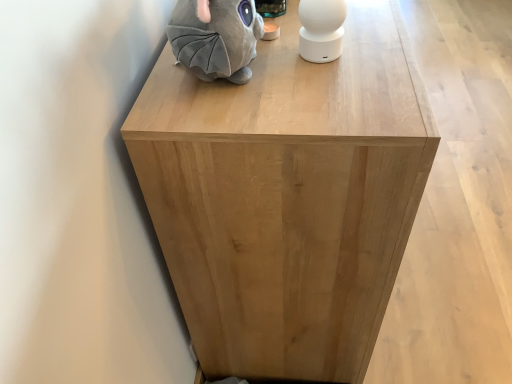
This screenshot has width=512, height=384. What do you see at coordinates (216, 39) in the screenshot?
I see `gray plush toy at upper left, the first toy viewed from the left` at bounding box center [216, 39].

The height and width of the screenshot is (384, 512). In order to click on gray plush toy at upper left, marked as the 2th toy in a right-to-left arrangement in this screenshot , I will do `click(216, 39)`.

Which object is closer to the camera, natural wood cabinet at center or white matte speaker at upper center, which is counted as the first toy, starting from the right?

natural wood cabinet at center is more forward.

Is white matte speaker at upper center, the second toy positioned from the left, at the back of natural wood cabinet at center?

That's not correct — natural wood cabinet at center is not looking away from white matte speaker at upper center, the second toy positioned from the left.

Looking at their sizes, would you say natural wood cabinet at center is wider or thinner than white matte speaker at upper center, the second toy positioned from the left?

natural wood cabinet at center is wider than white matte speaker at upper center, the second toy positioned from the left.

Is there a large distance between natural wood cabinet at center and white matte speaker at upper center, the second toy positioned from the left?

No, natural wood cabinet at center is in close proximity to white matte speaker at upper center, the second toy positioned from the left.

Which is correct: white matte speaker at upper center, which is counted as the first toy, starting from the right, is inside gray plush toy at upper left, the first toy viewed from the left, or outside of it?

white matte speaker at upper center, which is counted as the first toy, starting from the right, is not enclosed by gray plush toy at upper left, the first toy viewed from the left.

In terms of width, does white matte speaker at upper center, the second toy positioned from the left, look wider or thinner when compared to gray plush toy at upper left, marked as the 2th toy in a right-to-left arrangement?

In the image, white matte speaker at upper center, the second toy positioned from the left, appears to be more narrow than gray plush toy at upper left, marked as the 2th toy in a right-to-left arrangement.

Is white matte speaker at upper center, the second toy positioned from the left, positioned far away from gray plush toy at upper left, marked as the 2th toy in a right-to-left arrangement?

They are positioned close to each other.

From a real-world perspective, is white matte speaker at upper center, the second toy positioned from the left, on top of gray plush toy at upper left, marked as the 2th toy in a right-to-left arrangement?

Incorrect, from a real-world perspective, white matte speaker at upper center, the second toy positioned from the left, is lower than gray plush toy at upper left, marked as the 2th toy in a right-to-left arrangement.

Is gray plush toy at upper left, marked as the 2th toy in a right-to-left arrangement, not close to white matte speaker at upper center, which is counted as the first toy, starting from the right?

No, there isn't a large distance between gray plush toy at upper left, marked as the 2th toy in a right-to-left arrangement, and white matte speaker at upper center, which is counted as the first toy, starting from the right.

Is gray plush toy at upper left, marked as the 2th toy in a right-to-left arrangement, facing towards white matte speaker at upper center, the second toy positioned from the left?

Yes, gray plush toy at upper left, marked as the 2th toy in a right-to-left arrangement, is facing white matte speaker at upper center, the second toy positioned from the left.

Which object is positioned more to the left, gray plush toy at upper left, the first toy viewed from the left, or white matte speaker at upper center, which is counted as the first toy, starting from the right?

gray plush toy at upper left, the first toy viewed from the left.

Is gray plush toy at upper left, marked as the 2th toy in a right-to-left arrangement, a part of natural wood cabinet at center?

No, gray plush toy at upper left, marked as the 2th toy in a right-to-left arrangement, is located outside of natural wood cabinet at center.

Is point (316, 235) positioned in front of point (174, 41)?

No, (316, 235) is further to viewer.

How many degrees apart are the facing directions of natural wood cabinet at center and gray plush toy at upper left, marked as the 2th toy in a right-to-left arrangement?

There is a 2.75-degree angle between the facing directions of natural wood cabinet at center and gray plush toy at upper left, marked as the 2th toy in a right-to-left arrangement.

Is natural wood cabinet at center taller than gray plush toy at upper left, marked as the 2th toy in a right-to-left arrangement?

Result: Yes, natural wood cabinet at center is taller than gray plush toy at upper left, marked as the 2th toy in a right-to-left arrangement.

Would you say white matte speaker at upper center, the second toy positioned from the left, contains natural wood cabinet at center?

Definitely not — natural wood cabinet at center is not inside white matte speaker at upper center, the second toy positioned from the left.

Considering the points (305, 28) and (234, 117), which point is behind, point (305, 28) or point (234, 117)?

The point (305, 28) is more distant.

In terms of size, does white matte speaker at upper center, which is counted as the first toy, starting from the right, appear bigger or smaller than natural wood cabinet at center?

Considering their sizes, white matte speaker at upper center, which is counted as the first toy, starting from the right, takes up less space than natural wood cabinet at center.

Consider the image. Which point is more distant from viewer, (183, 33) or (336, 99)?

Point (336, 99)

Based on the photo, is gray plush toy at upper left, the first toy viewed from the left, turned away from natural wood cabinet at center?

No.

Considering the positions of objects gray plush toy at upper left, marked as the 2th toy in a right-to-left arrangement, and natural wood cabinet at center in the image provided, who is in front, gray plush toy at upper left, marked as the 2th toy in a right-to-left arrangement, or natural wood cabinet at center?

gray plush toy at upper left, marked as the 2th toy in a right-to-left arrangement, is in front.

Considering the sizes of gray plush toy at upper left, the first toy viewed from the left, and natural wood cabinet at center in the image, is gray plush toy at upper left, the first toy viewed from the left, wider or thinner than natural wood cabinet at center?

Clearly, gray plush toy at upper left, the first toy viewed from the left, has less width compared to natural wood cabinet at center.

What are the coordinates of `furniture located underneath the white matte speaker at upper center, the second toy positioned from the left (from a real-world perspective)` in the screenshot? It's located at (287, 196).

Locate an element on the screen. toy lying above the gray plush toy at upper left, the first toy viewed from the left (from the image's perspective) is located at coordinates (321, 29).

Estimate the real-world distances between objects in this image. Which object is closer to white matte speaker at upper center, the second toy positioned from the left, natural wood cabinet at center or gray plush toy at upper left, the first toy viewed from the left?

gray plush toy at upper left, the first toy viewed from the left.

When comparing their distances from natural wood cabinet at center, does gray plush toy at upper left, marked as the 2th toy in a right-to-left arrangement, or white matte speaker at upper center, which is counted as the first toy, starting from the right, seem closer?

Among the two, gray plush toy at upper left, marked as the 2th toy in a right-to-left arrangement, is located nearer to natural wood cabinet at center.

Which object lies nearer to the anchor point gray plush toy at upper left, the first toy viewed from the left, natural wood cabinet at center or white matte speaker at upper center, the second toy positioned from the left?

white matte speaker at upper center, the second toy positioned from the left.

Based on their spatial positions, is gray plush toy at upper left, the first toy viewed from the left, or natural wood cabinet at center further from white matte speaker at upper center, the second toy positioned from the left?

natural wood cabinet at center is further to white matte speaker at upper center, the second toy positioned from the left.

Based on their spatial positions, is white matte speaker at upper center, the second toy positioned from the left, or natural wood cabinet at center further from gray plush toy at upper left, marked as the 2th toy in a right-to-left arrangement?

Based on the image, natural wood cabinet at center appears to be further to gray plush toy at upper left, marked as the 2th toy in a right-to-left arrangement.

Considering their positions, is white matte speaker at upper center, the second toy positioned from the left, positioned further to natural wood cabinet at center than gray plush toy at upper left, marked as the 2th toy in a right-to-left arrangement?

white matte speaker at upper center, the second toy positioned from the left, lies further to natural wood cabinet at center than the other object.

Locate an element on the screen. The image size is (512, 384). toy between gray plush toy at upper left, the first toy viewed from the left, and natural wood cabinet at center, in the horizontal direction is located at coordinates (321, 29).